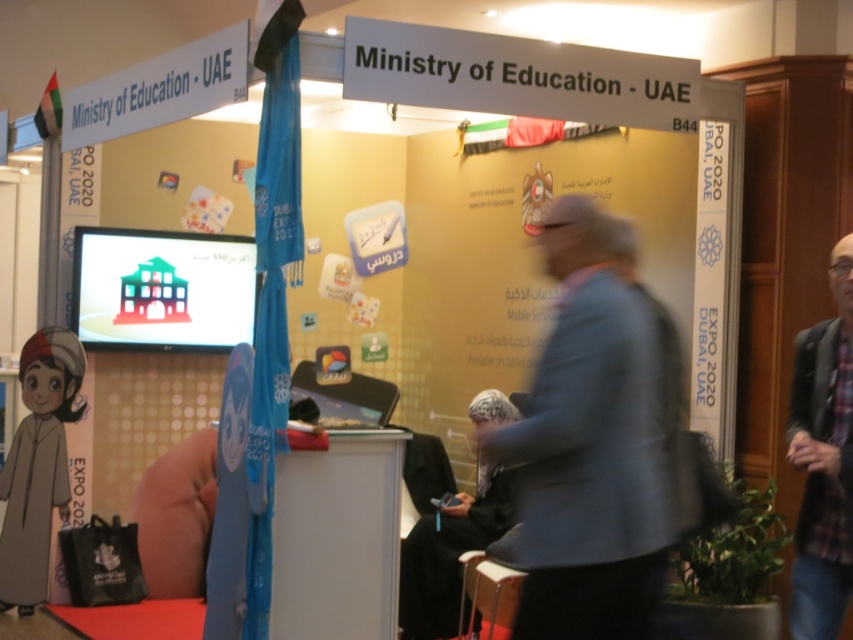
Question: Which object is farther from the camera taking this photo?

Choices:
 (A) gray fabric jacket at center
 (B) dark blue flannel shirt at right

Answer: (B)

Question: Is gray fabric jacket at center closer to camera compared to dark blue flannel shirt at right?

Choices:
 (A) yes
 (B) no

Answer: (A)

Question: From the image, what is the correct spatial relationship of gray fabric jacket at center in relation to dark blue flannel shirt at right?

Choices:
 (A) below
 (B) above

Answer: (B)

Question: Which point is farther to the camera?

Choices:
 (A) [x=843, y=582]
 (B) [x=566, y=621]

Answer: (A)

Question: Does gray fabric jacket at center appear under dark blue flannel shirt at right?

Choices:
 (A) yes
 (B) no

Answer: (B)

Question: Which of the following is the farthest from the observer?

Choices:
 (A) gray fabric jacket at center
 (B) dark blue flannel shirt at right

Answer: (B)